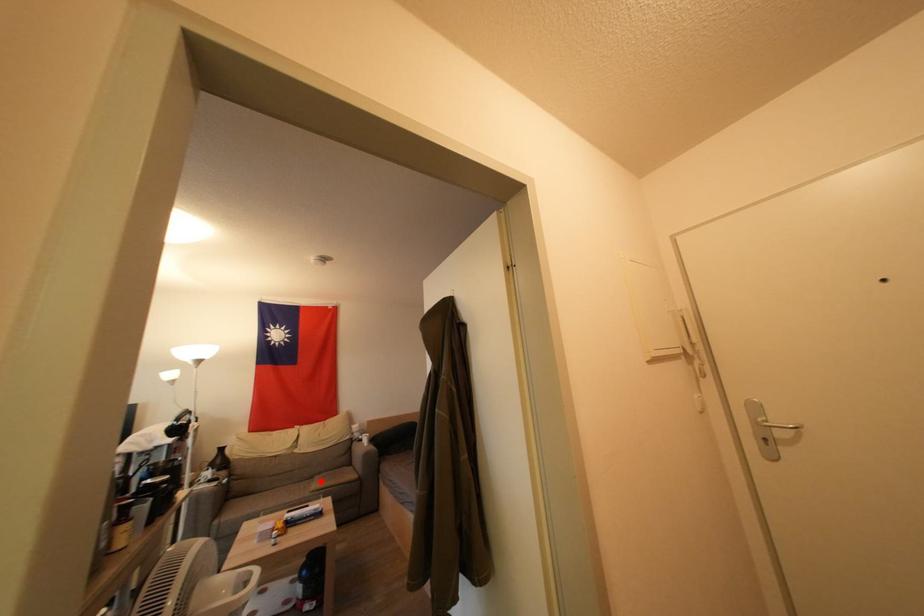
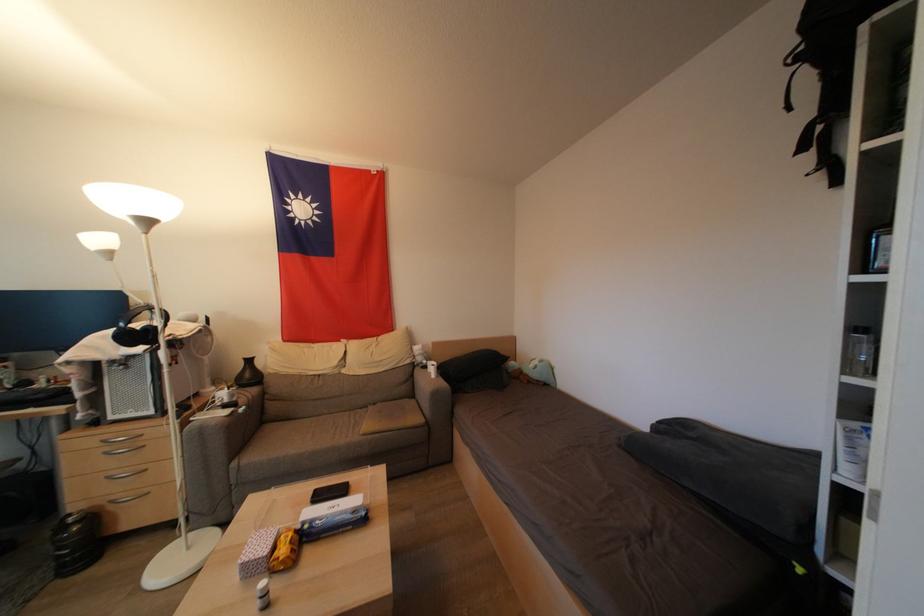
Question: I am providing you with two images of the same scene from different viewpoints. Given a red point in image1, look at the same physical point in image2. Is it:

Choices:
 (A) Closer to the viewpoint
 (B) Farther from the viewpoint

Answer: (A)